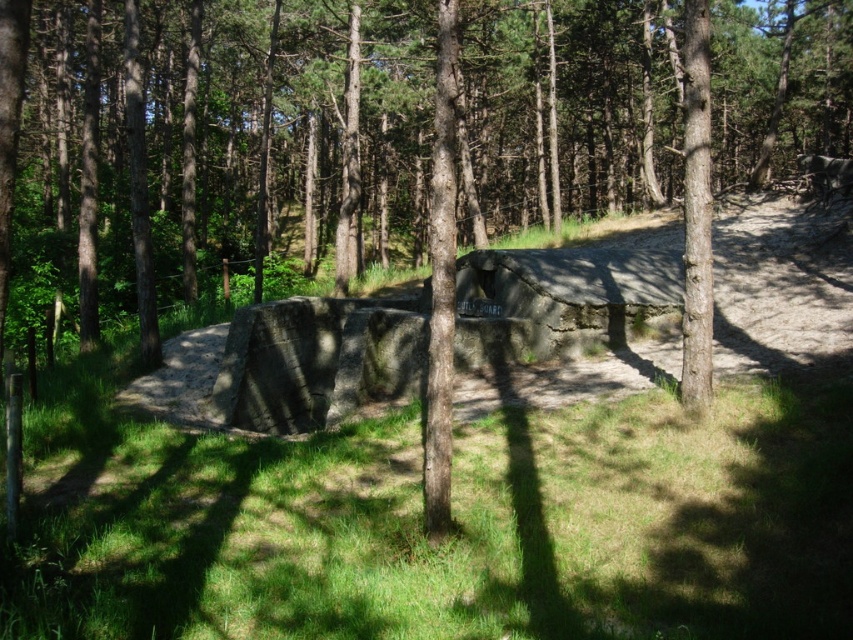
Is brown rough tree at center above green grass at center?

Indeed, brown rough tree at center is positioned over green grass at center.

Find the location of a particular element. This screenshot has width=853, height=640. brown rough tree at center is located at coordinates (206, 141).

This screenshot has height=640, width=853. I want to click on brown rough tree at center, so click(x=206, y=141).